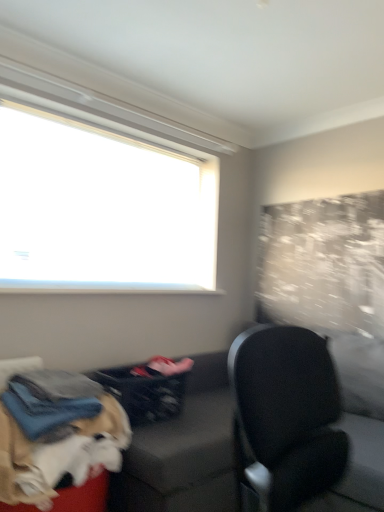
Question: From the image's perspective, is dark gray fabric laundry basket at lower center located beneath dark gray fabric couch at lower left?

Choices:
 (A) no
 (B) yes

Answer: (A)

Question: From a real-world perspective, is dark gray fabric laundry basket at lower center beneath dark gray fabric couch at lower left?

Choices:
 (A) yes
 (B) no

Answer: (B)

Question: Is dark gray fabric laundry basket at lower center positioned with its back to dark gray fabric couch at lower left?

Choices:
 (A) no
 (B) yes

Answer: (B)

Question: Considering the relative sizes of dark gray fabric laundry basket at lower center and dark gray fabric couch at lower left in the image provided, is dark gray fabric laundry basket at lower center smaller than dark gray fabric couch at lower left?

Choices:
 (A) no
 (B) yes

Answer: (B)

Question: Is dark gray fabric laundry basket at lower center located outside dark gray fabric couch at lower left?

Choices:
 (A) yes
 (B) no

Answer: (B)

Question: Are dark gray fabric laundry basket at lower center and dark gray fabric couch at lower left making contact?

Choices:
 (A) no
 (B) yes

Answer: (A)

Question: From the image's perspective, is dark gray fabric laundry basket at lower center on top of white fluffy dog at lower left?

Choices:
 (A) no
 (B) yes

Answer: (B)

Question: Considering the relative sizes of dark gray fabric laundry basket at lower center and white fluffy dog at lower left in the image provided, is dark gray fabric laundry basket at lower center taller than white fluffy dog at lower left?

Choices:
 (A) no
 (B) yes

Answer: (A)

Question: Is dark gray fabric laundry basket at lower center turned away from white fluffy dog at lower left?

Choices:
 (A) no
 (B) yes

Answer: (A)

Question: Is dark gray fabric laundry basket at lower center next to white fluffy dog at lower left and touching it?

Choices:
 (A) yes
 (B) no

Answer: (B)

Question: Can you confirm if dark gray fabric laundry basket at lower center is wider than white fluffy dog at lower left?

Choices:
 (A) yes
 (B) no

Answer: (B)

Question: Is dark gray fabric laundry basket at lower center oriented towards white fluffy dog at lower left?

Choices:
 (A) no
 (B) yes

Answer: (A)

Question: Considering the relative sizes of dark gray fabric couch at lower left and white fluffy dog at lower left in the image provided, is dark gray fabric couch at lower left shorter than white fluffy dog at lower left?

Choices:
 (A) no
 (B) yes

Answer: (A)